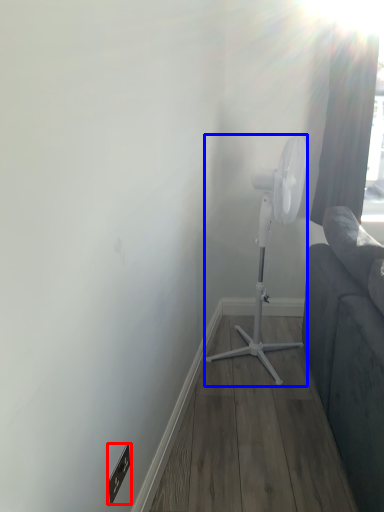
Question: Among these objects, which one is nearest to the camera, electric outlet (highlighted by a red box) or mechanical fan (highlighted by a blue box)?

Choices:
 (A) electric outlet
 (B) mechanical fan

Answer: (A)